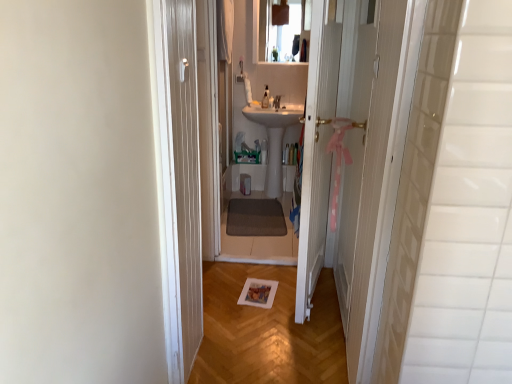
At what (x,y) coordinates should I click in order to perform the action: click on free space to the left of white wooden door at center. Please return your answer as a coordinate pair (x, y). Looking at the image, I should click on (254, 299).